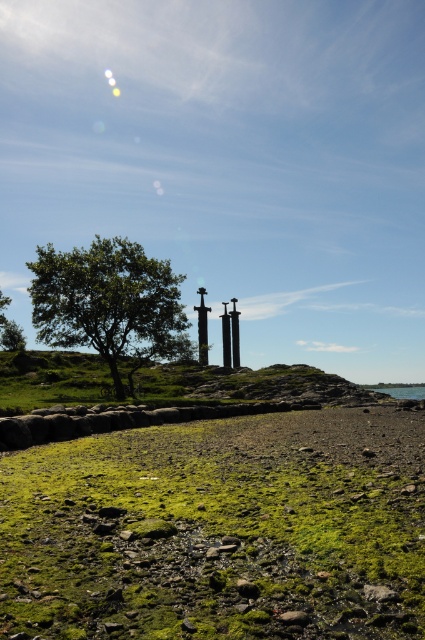
Which is behind, point (65, 276) or point (237, 316)?

The point (237, 316) is behind.

Who is more forward, (78, 308) or (238, 344)?

Point (78, 308) is more forward.

Where is `green leafy tree at center`? green leafy tree at center is located at coordinates (107, 301).

You are a GUI agent. You are given a task and a screenshot of the screen. Output one action in this format:
    pyautogui.click(x=<x>, y=<y>)
    Task: Click on the green leafy tree at center
    The image size is (425, 640).
    Given the screenshot: What is the action you would take?
    pyautogui.click(x=107, y=301)

Does black metal pole at center have a smaller size compared to polished metal sword at center?

Incorrect, black metal pole at center is not smaller in size than polished metal sword at center.

Which is in front, point (231, 300) or point (229, 317)?

Point (229, 317) is more forward.

Where is `black metal pole at center`? This screenshot has width=425, height=640. black metal pole at center is located at coordinates (235, 333).

Who is lower down, green leafy tree at center or polished metal sword at center?

Positioned lower is green leafy tree at center.

Can you confirm if green leafy tree at center is wider than polished metal sword at center?

Indeed, green leafy tree at center has a greater width compared to polished metal sword at center.

In the scene shown: Measure the distance between point (56, 301) and camera.

Point (56, 301) is 38.35 meters away from camera.

Locate an element on the screen. This screenshot has height=640, width=425. green leafy tree at center is located at coordinates (107, 301).